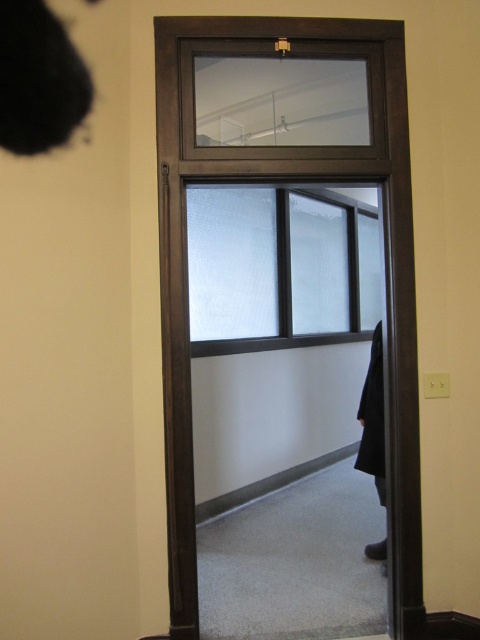
Which is above, matte dark brown glass door at center or frosted glass window at center?

Positioned higher is frosted glass window at center.

Between point (408, 218) and point (240, 323), which one is positioned in front?

Point (408, 218) is in front.

Who is more forward, (411, 611) or (225, 248)?

Point (411, 611) is in front.

Locate an element on the screen. The image size is (480, 640). matte dark brown glass door at center is located at coordinates (292, 180).

Can you confirm if frosted glass window at center is thinner than black fabric robe at right?

No, frosted glass window at center is not thinner than black fabric robe at right.

Who is positioned more to the right, frosted glass window at center or black fabric robe at right?

From the viewer's perspective, black fabric robe at right appears more on the right side.

Between point (298, 339) and point (360, 394), which one is positioned in front?

Point (298, 339) is more forward.

In order to click on frosted glass window at center in this screenshot , I will do `click(279, 268)`.

Is matte dark brown glass door at center shorter than black fabric robe at right?

In fact, matte dark brown glass door at center may be taller than black fabric robe at right.

Consider the image. Does matte dark brown glass door at center appear on the left side of black fabric robe at right?

Yes, matte dark brown glass door at center is to the left of black fabric robe at right.

Locate an element on the screen. matte dark brown glass door at center is located at coordinates (292, 180).

Where is `matte dark brown glass door at center`? This screenshot has height=640, width=480. matte dark brown glass door at center is located at coordinates (292, 180).